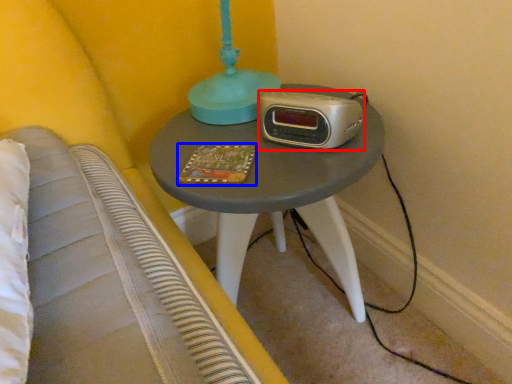
Question: Which object is further to the camera taking this photo, stereo (highlighted by a red box) or book (highlighted by a blue box)?

Choices:
 (A) stereo
 (B) book

Answer: (B)